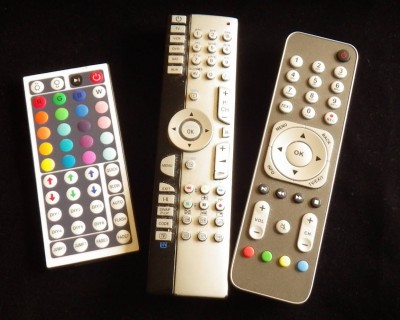
Find the location of a particular element. The image size is (400, 320). remote controls is located at coordinates (79, 163), (199, 254), (249, 269).